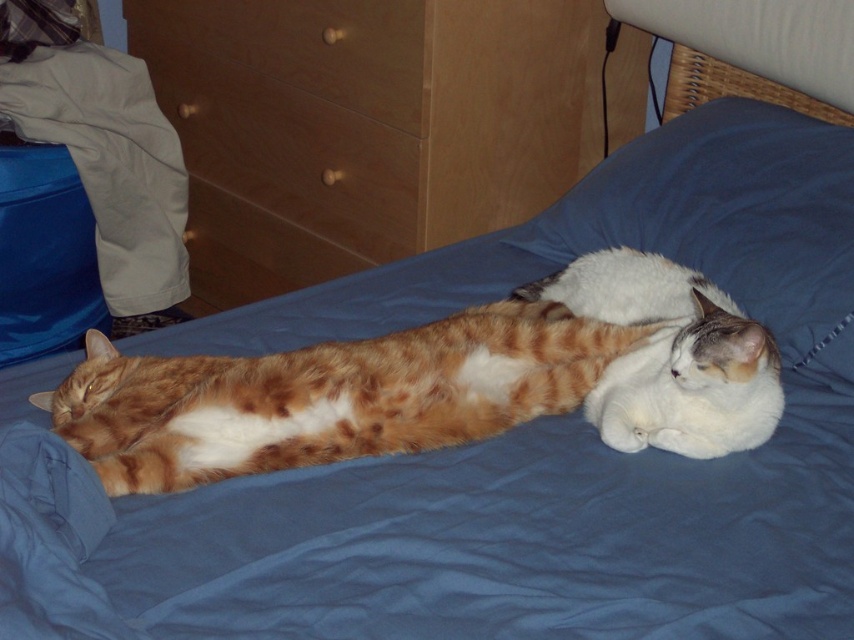
You are trying to reach the wooden drawer at upper left but there is an orange tabby cat at center in your way. Can you move around the cat to access the drawer?

The orange tabby cat at center is in front of the wooden drawer at upper left, so you would need to go around the cat to reach the drawer.

You are a photographer trying to capture a clear photo of the white fluffy cat at center and the wooden dresser at upper left. However, the wooden dresser is blocking part of the cat. Can you adjust your position to see both objects fully without any obstruction?

The white fluffy cat at center is behind the wooden dresser at upper left, so moving your position to the side or closer to the cat might allow you to see both objects without obstruction.